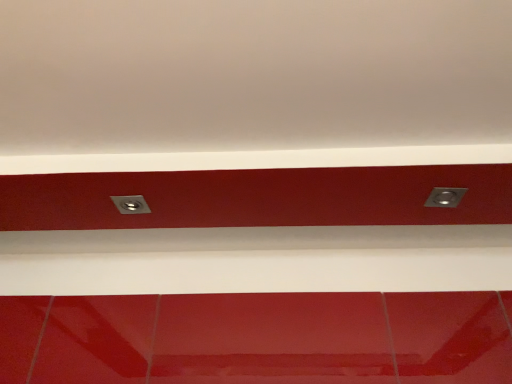
What is the approximate height of metallic silver socket at center, positioned as the 1th power plugs and sockets in left-to-right order?

metallic silver socket at center, positioned as the 1th power plugs and sockets in left-to-right order, is 0.58 inches tall.

I want to click on metallic silver socket at center, positioned as the 1th power plugs and sockets in left-to-right order, so click(131, 204).

What do you see at coordinates (131, 204) in the screenshot? The height and width of the screenshot is (384, 512). I see `metallic silver socket at center, positioned as the 1th power plugs and sockets in left-to-right order` at bounding box center [131, 204].

Find the location of a particular element. metallic silver power plug/socket at upper right, which appears as the second power plugs and sockets when viewed from the left is located at coordinates [x=445, y=197].

The width and height of the screenshot is (512, 384). Describe the element at coordinates (445, 197) in the screenshot. I see `metallic silver power plug/socket at upper right, the 1th power plugs and sockets viewed from the right` at that location.

Identify the location of metallic silver socket at center, positioned as the 1th power plugs and sockets in left-to-right order. (131, 204).

Based on the photo, considering the relative positions of metallic silver power plug/socket at upper right, which appears as the second power plugs and sockets when viewed from the left, and metallic silver socket at center, positioned as the 1th power plugs and sockets in left-to-right order, in the image provided, is metallic silver power plug/socket at upper right, which appears as the second power plugs and sockets when viewed from the left, to the right of metallic silver socket at center, positioned as the 1th power plugs and sockets in left-to-right order, from the viewer's perspective?

Correct, you'll find metallic silver power plug/socket at upper right, which appears as the second power plugs and sockets when viewed from the left, to the right of metallic silver socket at center, positioned as the 1th power plugs and sockets in left-to-right order.

In the scene shown: In the image, is metallic silver power plug/socket at upper right, which appears as the second power plugs and sockets when viewed from the left, positioned in front of or behind metallic silver socket at center, positioned as the 1th power plugs and sockets in left-to-right order?

In the image, metallic silver power plug/socket at upper right, which appears as the second power plugs and sockets when viewed from the left, appears in front of metallic silver socket at center, positioned as the 1th power plugs and sockets in left-to-right order.

Does point (449, 200) lie behind point (119, 204)?

No, it is in front of (119, 204).

From the image's perspective, is metallic silver power plug/socket at upper right, the 1th power plugs and sockets viewed from the right, under metallic silver socket at center, positioned as the 1th power plugs and sockets in left-to-right order?

No.

From a real-world perspective, is metallic silver power plug/socket at upper right, which appears as the second power plugs and sockets when viewed from the left, over metallic silver socket at center, positioned as the 1th power plugs and sockets in left-to-right order?

No, from a real-world perspective, metallic silver power plug/socket at upper right, which appears as the second power plugs and sockets when viewed from the left, is not above metallic silver socket at center, positioned as the 1th power plugs and sockets in left-to-right order.

Considering the relative sizes of metallic silver power plug/socket at upper right, which appears as the second power plugs and sockets when viewed from the left, and metallic silver socket at center, the second power plugs and sockets viewed from the right, in the image provided, is metallic silver power plug/socket at upper right, which appears as the second power plugs and sockets when viewed from the left, wider than metallic silver socket at center, the second power plugs and sockets viewed from the right,?

No, metallic silver power plug/socket at upper right, which appears as the second power plugs and sockets when viewed from the left, is not wider than metallic silver socket at center, the second power plugs and sockets viewed from the right.

Can you confirm if metallic silver power plug/socket at upper right, which appears as the second power plugs and sockets when viewed from the left, is shorter than metallic silver socket at center, the second power plugs and sockets viewed from the right?

No, metallic silver power plug/socket at upper right, which appears as the second power plugs and sockets when viewed from the left, is not shorter than metallic silver socket at center, the second power plugs and sockets viewed from the right.

Does metallic silver power plug/socket at upper right, the 1th power plugs and sockets viewed from the right, have a larger size compared to metallic silver socket at center, the second power plugs and sockets viewed from the right?

Yes.

Is metallic silver power plug/socket at upper right, the 1th power plugs and sockets viewed from the right, completely or partially outside of metallic silver socket at center, the second power plugs and sockets viewed from the right?

metallic silver power plug/socket at upper right, the 1th power plugs and sockets viewed from the right, lies outside metallic silver socket at center, the second power plugs and sockets viewed from the right,'s area.

Looking at this image, is metallic silver power plug/socket at upper right, which appears as the second power plugs and sockets when viewed from the left, beside metallic silver socket at center, the second power plugs and sockets viewed from the right?

They are not placed beside each other.

Is metallic silver power plug/socket at upper right, which appears as the second power plugs and sockets when viewed from the left, positioned with its back to metallic silver socket at center, the second power plugs and sockets viewed from the right?

metallic silver power plug/socket at upper right, which appears as the second power plugs and sockets when viewed from the left, is not turned away from metallic silver socket at center, the second power plugs and sockets viewed from the right.

How different are the orientations of metallic silver power plug/socket at upper right, which appears as the second power plugs and sockets when viewed from the left, and metallic silver socket at center, positioned as the 1th power plugs and sockets in left-to-right order, in degrees?

metallic silver power plug/socket at upper right, which appears as the second power plugs and sockets when viewed from the left, and metallic silver socket at center, positioned as the 1th power plugs and sockets in left-to-right order, are facing 5.24 degrees away from each other.

Find the location of `power plugs and sockets located above the metallic silver socket at center, positioned as the 1th power plugs and sockets in left-to-right order (from the image's perspective)`. power plugs and sockets located above the metallic silver socket at center, positioned as the 1th power plugs and sockets in left-to-right order (from the image's perspective) is located at coordinates (445, 197).

Does metallic silver socket at center, positioned as the 1th power plugs and sockets in left-to-right order, appear on the right side of metallic silver power plug/socket at upper right, which appears as the second power plugs and sockets when viewed from the left?

In fact, metallic silver socket at center, positioned as the 1th power plugs and sockets in left-to-right order, is to the left of metallic silver power plug/socket at upper right, which appears as the second power plugs and sockets when viewed from the left.

Based on the photo, is the depth of metallic silver socket at center, the second power plugs and sockets viewed from the right, greater than that of metallic silver power plug/socket at upper right, the 1th power plugs and sockets viewed from the right?

Yes, metallic silver socket at center, the second power plugs and sockets viewed from the right, is behind metallic silver power plug/socket at upper right, the 1th power plugs and sockets viewed from the right.

Which point is more forward, (135, 202) or (449, 197)?

The point (449, 197) is closer.

From the image's perspective, is metallic silver socket at center, the second power plugs and sockets viewed from the right, positioned above or below metallic silver power plug/socket at upper right, the 1th power plugs and sockets viewed from the right?

Based on their image positions, metallic silver socket at center, the second power plugs and sockets viewed from the right, is located beneath metallic silver power plug/socket at upper right, the 1th power plugs and sockets viewed from the right.

From a real-world perspective, is metallic silver socket at center, the second power plugs and sockets viewed from the right, located higher than metallic silver power plug/socket at upper right, which appears as the second power plugs and sockets when viewed from the left?

Yes, from a real-world perspective, metallic silver socket at center, the second power plugs and sockets viewed from the right, is over metallic silver power plug/socket at upper right, which appears as the second power plugs and sockets when viewed from the left

Which of these two, metallic silver socket at center, the second power plugs and sockets viewed from the right, or metallic silver power plug/socket at upper right, which appears as the second power plugs and sockets when viewed from the left, is thinner?

metallic silver power plug/socket at upper right, which appears as the second power plugs and sockets when viewed from the left.

In terms of height, does metallic silver socket at center, the second power plugs and sockets viewed from the right, look taller or shorter compared to metallic silver power plug/socket at upper right, which appears as the second power plugs and sockets when viewed from the left?

In the image, metallic silver socket at center, the second power plugs and sockets viewed from the right, appears to be shorter than metallic silver power plug/socket at upper right, which appears as the second power plugs and sockets when viewed from the left.

Does metallic silver socket at center, positioned as the 1th power plugs and sockets in left-to-right order, have a smaller size compared to metallic silver power plug/socket at upper right, which appears as the second power plugs and sockets when viewed from the left?

Indeed, metallic silver socket at center, positioned as the 1th power plugs and sockets in left-to-right order, has a smaller size compared to metallic silver power plug/socket at upper right, which appears as the second power plugs and sockets when viewed from the left.

Is metallic silver socket at center, positioned as the 1th power plugs and sockets in left-to-right order, located outside metallic silver power plug/socket at upper right, which appears as the second power plugs and sockets when viewed from the left?

That's correct, metallic silver socket at center, positioned as the 1th power plugs and sockets in left-to-right order, is outside of metallic silver power plug/socket at upper right, which appears as the second power plugs and sockets when viewed from the left.

Is metallic silver socket at center, positioned as the 1th power plugs and sockets in left-to-right order, far from metallic silver power plug/socket at upper right, which appears as the second power plugs and sockets when viewed from the left?

No, metallic silver socket at center, positioned as the 1th power plugs and sockets in left-to-right order, is in close proximity to metallic silver power plug/socket at upper right, which appears as the second power plugs and sockets when viewed from the left.

Is metallic silver socket at center, positioned as the 1th power plugs and sockets in left-to-right order, looking in the opposite direction of metallic silver power plug/socket at upper right, the 1th power plugs and sockets viewed from the right?

No, metallic silver power plug/socket at upper right, the 1th power plugs and sockets viewed from the right, is not at the back of metallic silver socket at center, positioned as the 1th power plugs and sockets in left-to-right order.

This screenshot has width=512, height=384. I want to click on power plugs and sockets lying on the right of metallic silver socket at center, positioned as the 1th power plugs and sockets in left-to-right order, so click(445, 197).

Find the location of a particular element. The image size is (512, 384). power plugs and sockets behind the metallic silver power plug/socket at upper right, the 1th power plugs and sockets viewed from the right is located at coordinates (131, 204).

You are a GUI agent. You are given a task and a screenshot of the screen. Output one action in this format:
    pyautogui.click(x=<x>, y=<y>)
    Task: Click on the power plugs and sockets in front of the metallic silver socket at center, the second power plugs and sockets viewed from the right
    This screenshot has width=512, height=384.
    Given the screenshot: What is the action you would take?
    pyautogui.click(x=445, y=197)